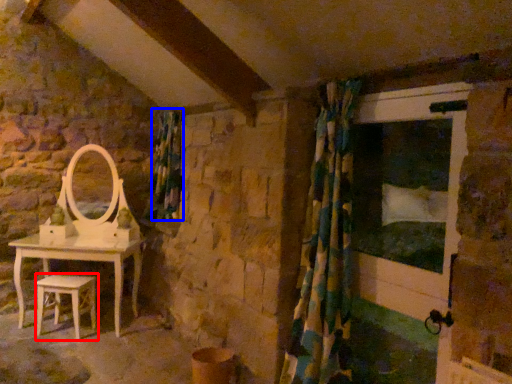
Question: Which of the following is the farthest to the observer, stool (highlighted by a red box) or curtain (highlighted by a blue box)?

Choices:
 (A) stool
 (B) curtain

Answer: (B)